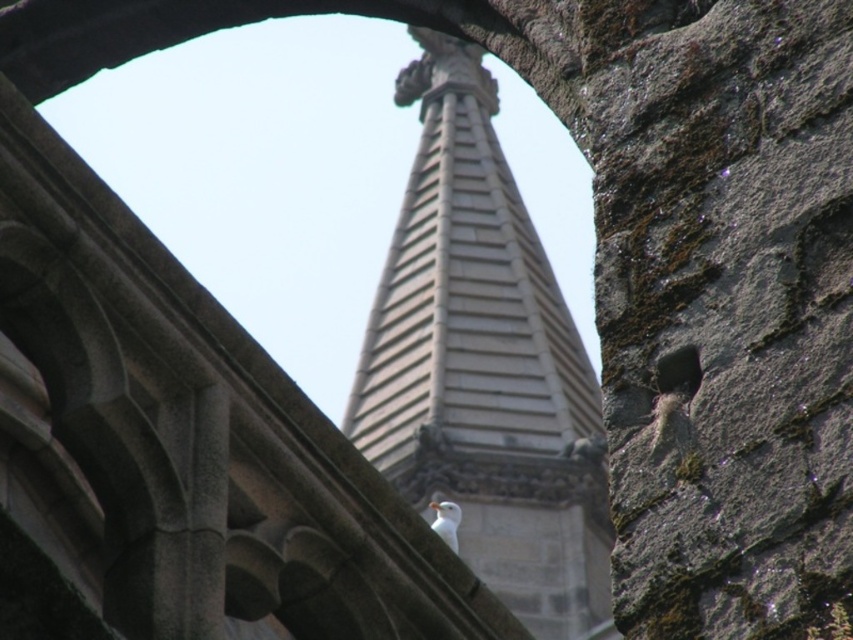
Question: Is gray stone tower at center to the right of white feathered bird at center from the viewer's perspective?

Choices:
 (A) yes
 (B) no

Answer: (A)

Question: Which point is closer to the camera taking this photo?

Choices:
 (A) (459, 509)
 (B) (445, 445)

Answer: (A)

Question: Is gray stone tower at center closer to the viewer compared to white feathered bird at center?

Choices:
 (A) no
 (B) yes

Answer: (A)

Question: Can you confirm if gray stone tower at center is positioned below white feathered bird at center?

Choices:
 (A) yes
 (B) no

Answer: (B)

Question: Among these points, which one is nearest to the camera?

Choices:
 (A) (442, 257)
 (B) (436, 513)

Answer: (B)